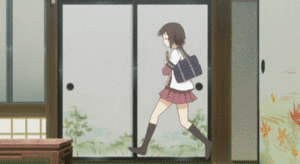
I want to click on later on in the gift there are golden lights near the floor on the wall, so click(43, 129).